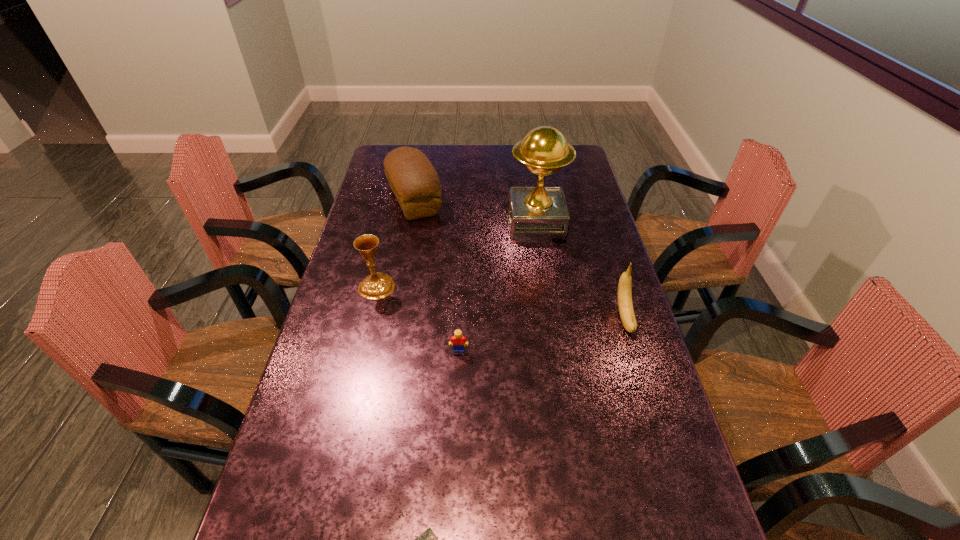
This screenshot has width=960, height=540. What are the coordinates of `award` in the screenshot? It's located at (536, 214).

The height and width of the screenshot is (540, 960). Find the location of `the fifth object from left to right`. the fifth object from left to right is located at coordinates (536, 214).

The width and height of the screenshot is (960, 540). Identify the location of bread. (412, 178).

Locate an element on the screen. chalice is located at coordinates (378, 285).

The width and height of the screenshot is (960, 540). What are the coordinates of `banana` in the screenshot? It's located at (625, 304).

Where is `the fifth farthest object`? Image resolution: width=960 pixels, height=540 pixels. the fifth farthest object is located at coordinates (458, 339).

Find the location of a particular element. This screenshot has width=960, height=540. the fifth tallest object is located at coordinates (458, 339).

Locate an element on the screen. The width and height of the screenshot is (960, 540). vacant region located 0.330m on the front-facing side of the second object from right to left is located at coordinates pyautogui.click(x=416, y=226).

The width and height of the screenshot is (960, 540). In order to click on free spot located on the front-facing side of the second object from right to left in this screenshot , I will do `click(474, 226)`.

Image resolution: width=960 pixels, height=540 pixels. I want to click on free space located on the front-facing side of the second object from right to left, so click(x=460, y=226).